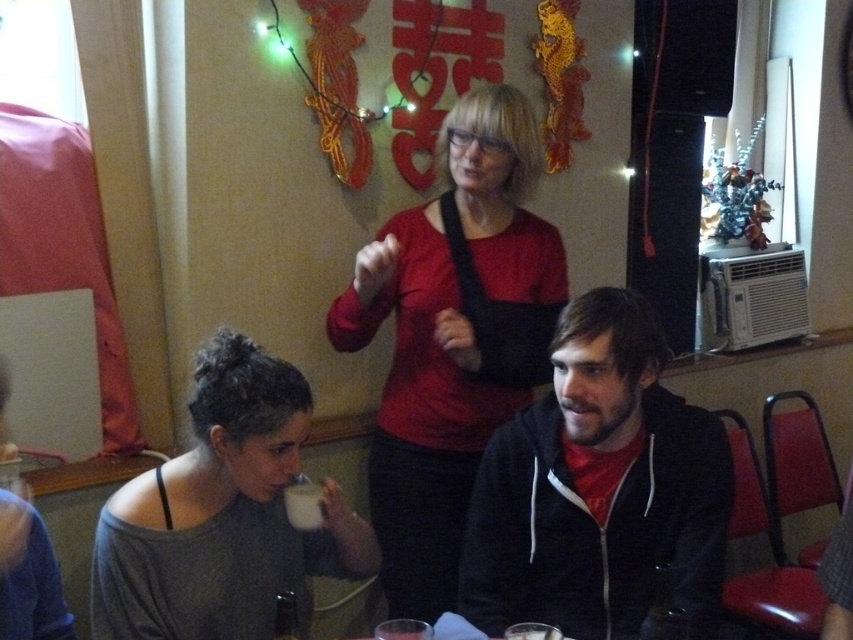
Question: Which of the following is the closest to the observer?

Choices:
 (A) (294, 483)
 (B) (393, 244)

Answer: (A)

Question: Among these points, which one is nearest to the camera?

Choices:
 (A) (322, 520)
 (B) (488, 572)
 (C) (482, 248)
 (D) (93, 636)

Answer: (D)

Question: Can you confirm if gray matte shirt at lower left is positioned above white glossy mug at lower center?

Choices:
 (A) yes
 (B) no

Answer: (B)

Question: Which of the following is the closest to the observer?

Choices:
 (A) (527, 621)
 (B) (621, 353)
 (C) (123, 544)

Answer: (C)

Question: Observing the image, what is the correct spatial positioning of gray matte shirt at lower left in reference to white matte cup at lower center?

Choices:
 (A) below
 (B) above

Answer: (B)

Question: Does matte red shirt at center have a larger size compared to gray matte shirt at lower left?

Choices:
 (A) no
 (B) yes

Answer: (B)